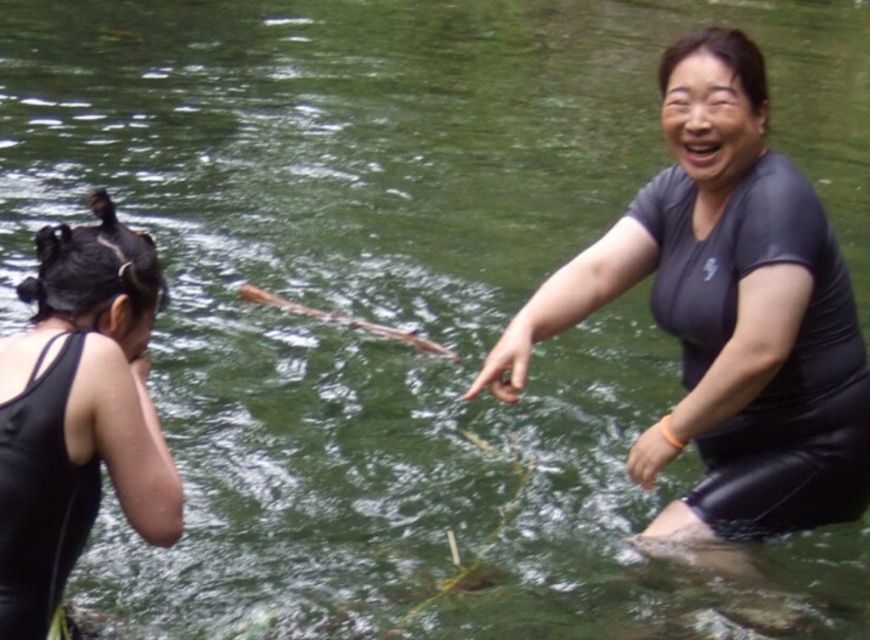
Can you confirm if black matte swimsuit at center is thinner than black matte wetsuit at right?

Incorrect, black matte swimsuit at center's width is not less than black matte wetsuit at right's.

Which of these two, black matte swimsuit at center or black matte wetsuit at right, stands shorter?

black matte wetsuit at right is shorter.

Which is in front, point (821, 433) or point (784, 497)?

Point (821, 433) is in front.

Where is `black matte swimsuit at center`? The width and height of the screenshot is (870, 640). black matte swimsuit at center is located at coordinates click(x=727, y=316).

Between black matte swimsuit at left and black matte wetsuit at left, which one is positioned lower?

black matte wetsuit at left is lower down.

How distant is black matte swimsuit at left from black matte wetsuit at left?

1.73 inches

Image resolution: width=870 pixels, height=640 pixels. Describe the element at coordinates (78, 412) in the screenshot. I see `black matte swimsuit at left` at that location.

Find the location of a particular element. This screenshot has height=640, width=870. black matte swimsuit at left is located at coordinates (78, 412).

Between black matte wetsuit at right and black matte swimsuit at left, which one has less height?

black matte swimsuit at left is shorter.

Who is more forward, (814, 326) or (166, 531)?

Point (166, 531) is more forward.

Image resolution: width=870 pixels, height=640 pixels. I want to click on black matte wetsuit at right, so click(x=780, y=364).